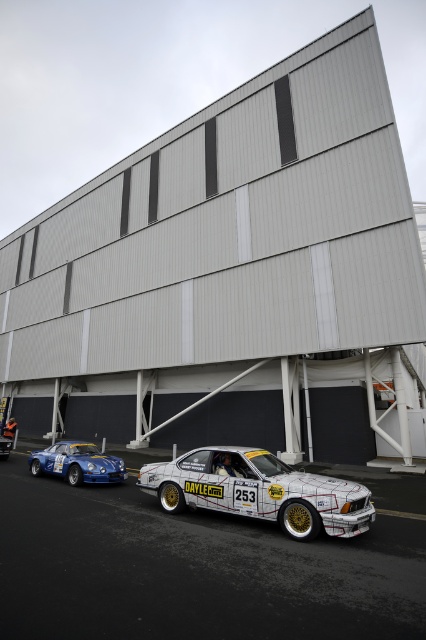
Which is behind, point (23, 602) or point (299, 522)?

The point (299, 522) is behind.

This screenshot has width=426, height=640. What do you see at coordinates (192, 570) in the screenshot?
I see `white painted asphalt at lower center` at bounding box center [192, 570].

This screenshot has width=426, height=640. Identify the location of white painted asphalt at lower center. (192, 570).

Is gray metallic building at center below blue metallic car at lower left?

No, gray metallic building at center is not below blue metallic car at lower left.

Which is below, gray metallic building at center or blue metallic car at lower left?

blue metallic car at lower left is below.

Does point (310, 372) come in front of point (81, 449)?

That is False.

What are the coordinates of `gray metallic building at center` in the screenshot? It's located at (233, 276).

Between white/striped/panel car at center and blue metallic car at lower left, which one has more height?

white/striped/panel car at center

Between point (290, 506) and point (66, 468), which one is positioned in front?

Positioned in front is point (290, 506).

This screenshot has width=426, height=640. Describe the element at coordinates (259, 492) in the screenshot. I see `white/striped/panel car at center` at that location.

The height and width of the screenshot is (640, 426). Identify the location of white/striped/panel car at center. (259, 492).